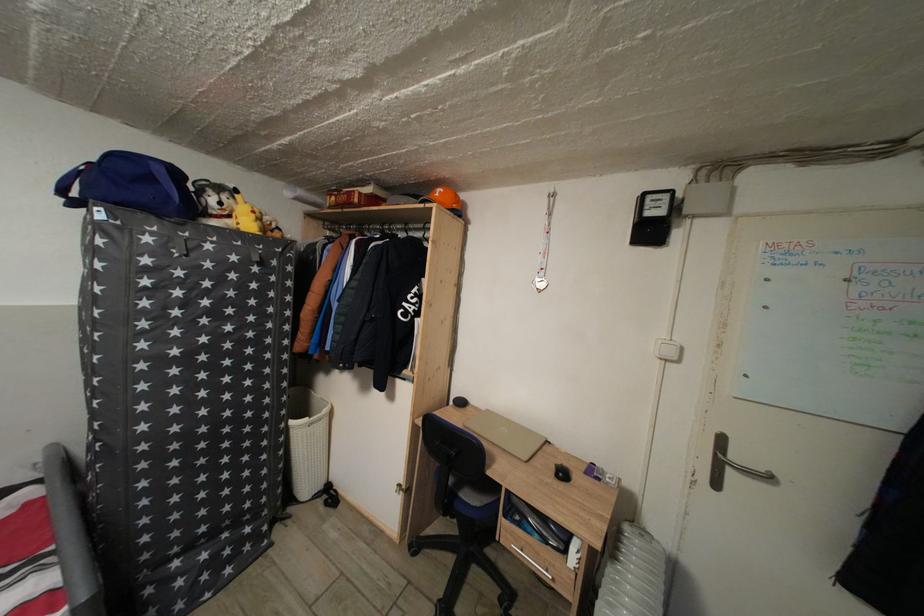
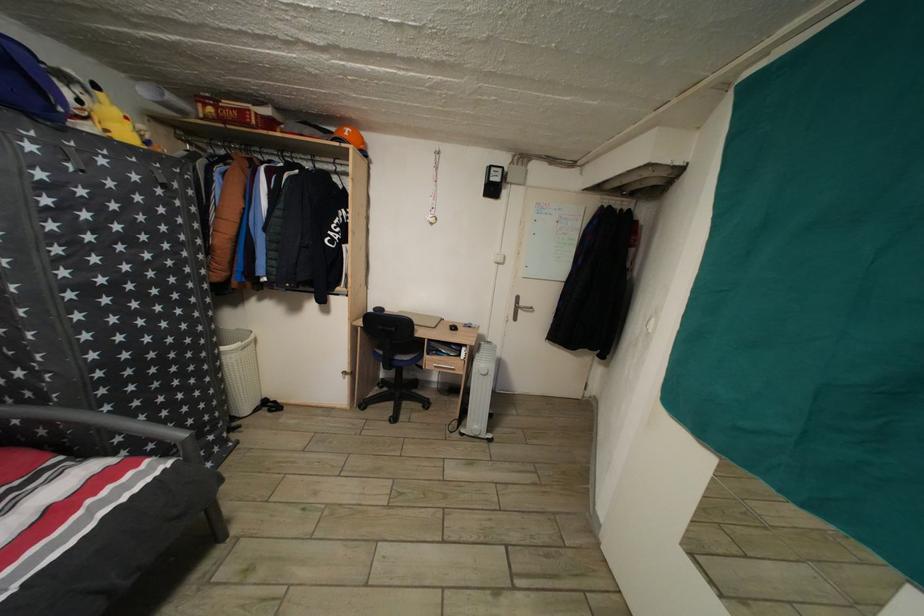
Find the pixel in the second image that matches (x=526, y=531) in the first image.

(443, 361)